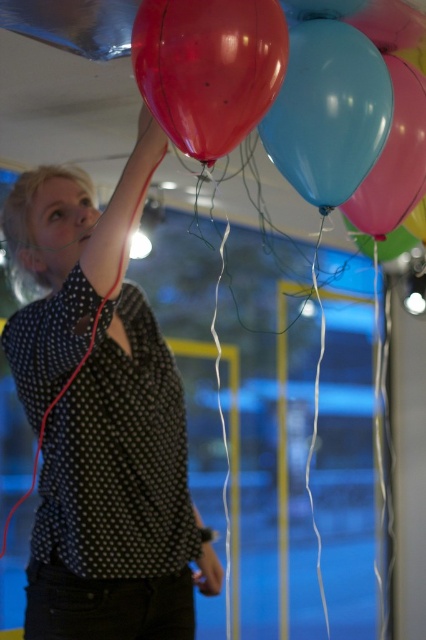
Which is above, matte black shirt at upper left or glossy rubber balloon at upper center?

glossy rubber balloon at upper center

Does matte black shirt at upper left have a larger size compared to glossy rubber balloon at upper center?

Indeed, matte black shirt at upper left has a larger size compared to glossy rubber balloon at upper center.

This screenshot has width=426, height=640. Find the location of `matte black shirt at upper left`. matte black shirt at upper left is located at coordinates (101, 417).

Can you confirm if matte black shirt at upper left is thinner than glossy blue balloon at center?

In fact, matte black shirt at upper left might be wider than glossy blue balloon at center.

Can you confirm if matte black shirt at upper left is wider than glossy blue balloon at center?

Correct, the width of matte black shirt at upper left exceeds that of glossy blue balloon at center.

Where is `matte black shirt at upper left`? This screenshot has height=640, width=426. matte black shirt at upper left is located at coordinates (101, 417).

Who is more forward, [210,152] or [321,22]?

Point [210,152] is in front.

Is glossy rubber balloon at upper center below glossy blue balloon at center?

Incorrect, glossy rubber balloon at upper center is not positioned below glossy blue balloon at center.

Where is `glossy rubber balloon at upper center`? glossy rubber balloon at upper center is located at coordinates (209, 68).